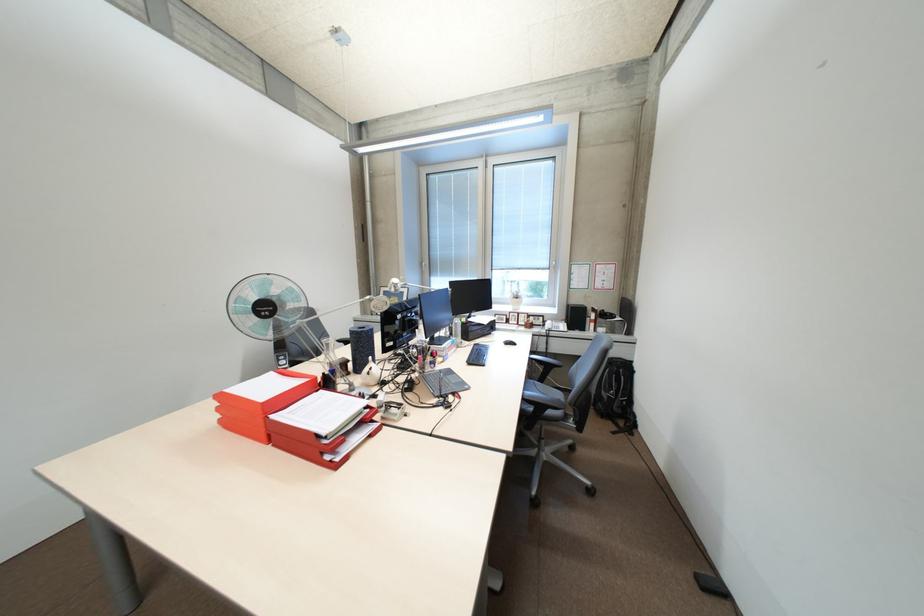
Where would you resting arm the chair armrest? Please return your answer as a coordinate pair (x, y).

(541, 402)